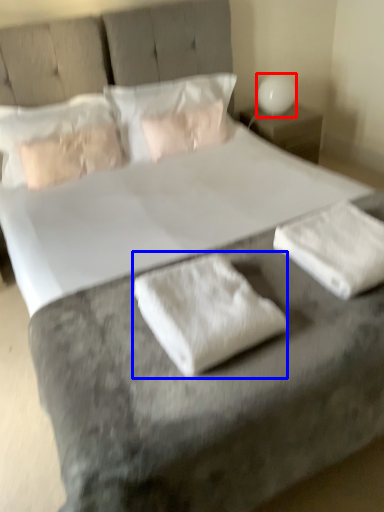
Question: Which of the following is the farthest to the observer, table lamp (highlighted by a red box) or material (highlighted by a blue box)?

Choices:
 (A) table lamp
 (B) material

Answer: (A)